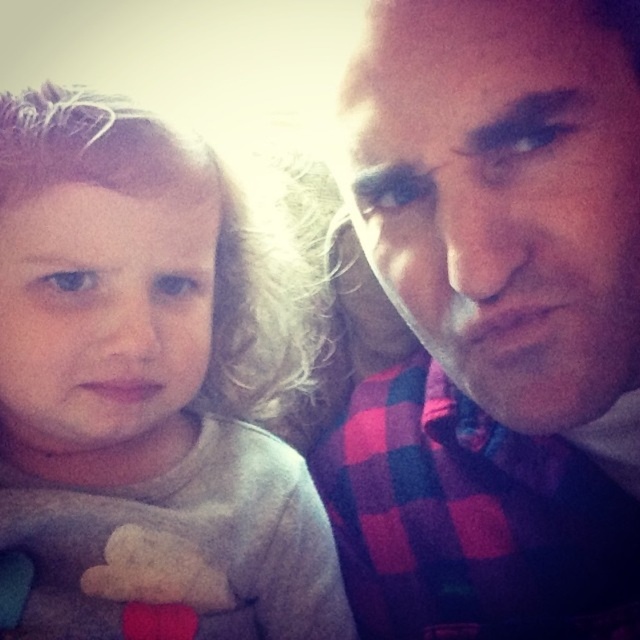
You are a tailor observing the image and need to determine the placement of the plaid fabric shirt at right and the gray soft fabric at left. Which fabric is positioned higher in the image?

The gray soft fabric at left is positioned higher than the plaid fabric shirt at right.

You are taking a photo of two people in the scene. The camera is at your eye level. You want to focus on the point closer to the camera. Which point should you choose between point [314,451] and point [77,285]?

Point [77,285] is closer to the camera than point [314,451], so you should choose point [77,285] to focus on.

You are trying to locate the point at coordinates (497, 323) in the image. Based on the scene description, which object does this point lie on?

The point at coordinates (497, 323) lies on the plaid fabric shirt at right.